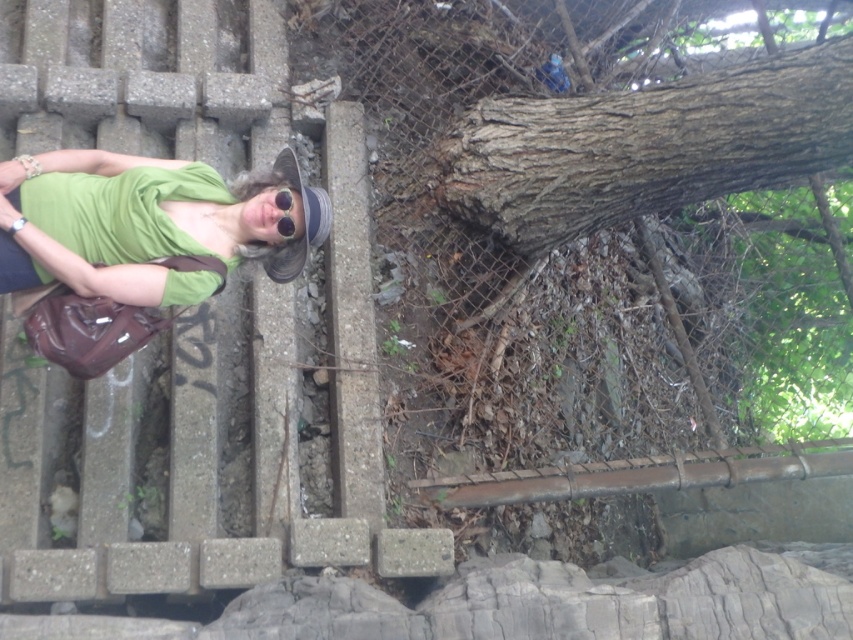
Is green matte shirt at left to the right of black matte sunglasses at center from the viewer's perspective?

No, green matte shirt at left is not to the right of black matte sunglasses at center.

From the picture: Can you confirm if green matte shirt at left is taller than black matte sunglasses at center?

Indeed, green matte shirt at left has a greater height compared to black matte sunglasses at center.

Image resolution: width=853 pixels, height=640 pixels. What do you see at coordinates (155, 224) in the screenshot?
I see `green matte shirt at left` at bounding box center [155, 224].

At what (x,y) coordinates should I click in order to perform the action: click on green matte shirt at left. Please return your answer as a coordinate pair (x, y). This screenshot has height=640, width=853. Looking at the image, I should click on (155, 224).